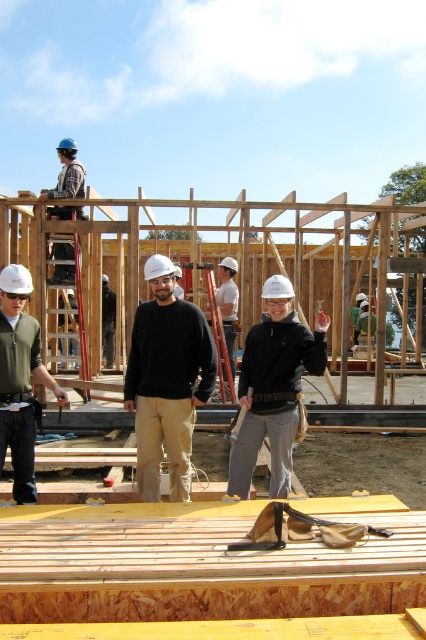
Question: Estimate the real-world distances between objects in this image. Which object is farther from the matte black helmet at upper left?

Choices:
 (A) wooden frame at center
 (B) white hard hat at center
 (C) green matte vest at center
 (D) matte black jacket at center

Answer: (D)

Question: Among these objects, which one is nearest to the camera?

Choices:
 (A) green matte vest at center
 (B) white hard hat at center

Answer: (A)

Question: Where is green matte vest at center located in relation to white hard hat at center in the image?

Choices:
 (A) below
 (B) above

Answer: (A)

Question: Does matte black jacket at center appear on the right side of green matte vest at center?

Choices:
 (A) yes
 (B) no

Answer: (A)

Question: Does matte black jacket at center appear on the right side of white hard hat at center?

Choices:
 (A) yes
 (B) no

Answer: (A)

Question: Which object appears farthest from the camera in this image?

Choices:
 (A) matte black helmet at upper left
 (B) matte black jacket at center

Answer: (A)